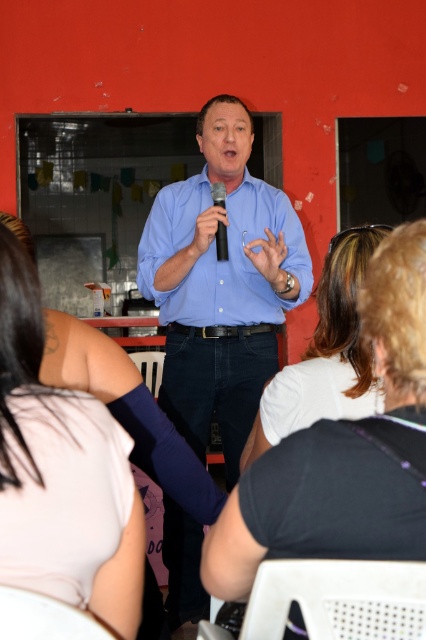
Question: Considering the relative positions of blue shirt at center and blue button-up shirt at center in the image provided, where is blue shirt at center located with respect to blue button-up shirt at center?

Choices:
 (A) left
 (B) right

Answer: (A)

Question: Is blue shirt at center bigger than pink fabric arm at left?

Choices:
 (A) no
 (B) yes

Answer: (B)

Question: Estimate the real-world distances between objects in this image. Which object is closer to the white fabric shirt at center?

Choices:
 (A) white t-shirt at center
 (B) blue shirt at center

Answer: (A)

Question: Can you confirm if pink fabric arm at left is positioned below blue button-up shirt at center?

Choices:
 (A) yes
 (B) no

Answer: (A)

Question: Which of the following is the farthest from the observer?

Choices:
 (A) (239, 378)
 (B) (51, 448)
 (C) (227, 259)
 (D) (377, 336)

Answer: (A)

Question: Which point is farther to the camera?

Choices:
 (A) (241, 404)
 (B) (221, 237)
 (C) (201, 566)

Answer: (A)